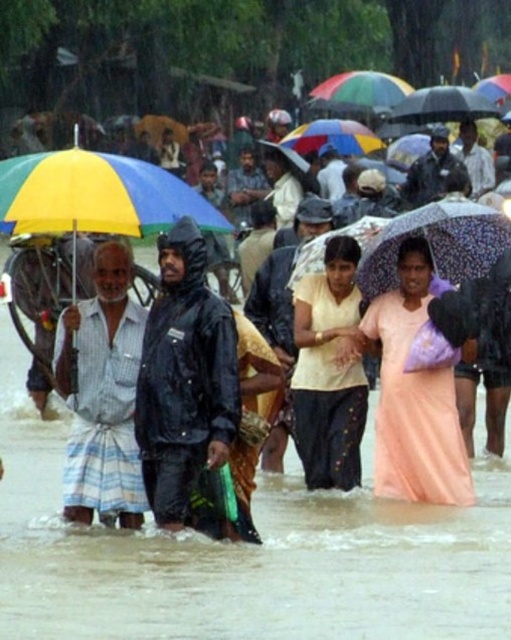
Is black matte raincoat at center above yellowmatteumbrella at left?

No.

Which is more to the left, black matte raincoat at center or yellowmatteumbrella at left?

Positioned to the left is yellowmatteumbrella at left.

Is point (206, 288) positioned behind point (40, 195)?

Yes, point (206, 288) is farther from viewer.

Locate an element on the screen. The width and height of the screenshot is (511, 640). black matte raincoat at center is located at coordinates (184, 378).

Does point (65, 502) come in front of point (450, 486)?

Yes, point (65, 502) is in front of point (450, 486).

Can you confirm if striped fabric dhoti at left is smaller than pink satin dress at center?

Yes, striped fabric dhoti at left is smaller than pink satin dress at center.

The height and width of the screenshot is (640, 511). Find the location of `striped fabric dhoti at left`. striped fabric dhoti at left is located at coordinates (103, 394).

Does point (187, 298) lie behind point (123, 330)?

No, (187, 298) is in front of (123, 330).

Is point (147, 419) closer to viewer compared to point (75, 406)?

Yes, it is.

Where is `black matte raincoat at center`? black matte raincoat at center is located at coordinates (184, 378).